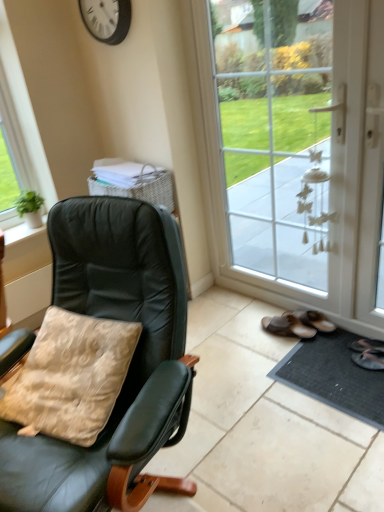
What is the approximate width of white plastic clock at upper center?

It is 6.50 centimeters.

What do you see at coordinates (288, 151) in the screenshot? Image resolution: width=384 pixels, height=512 pixels. I see `white glass door at center` at bounding box center [288, 151].

You are a GUI agent. You are given a task and a screenshot of the screen. Output one action in this format:
    pyautogui.click(x=<x>, y=<y>)
    Task: Click on the matte black chair at left
    
    Given the screenshot: What is the action you would take?
    pyautogui.click(x=131, y=361)

In the image, is matte black chair at left positioned in front of or behind white plastic clock at upper center?

In the image, matte black chair at left appears in front of white plastic clock at upper center.

From a real-world perspective, which is physically above, matte black chair at left or white plastic clock at upper center?

In real-world perspective, white plastic clock at upper center is above.

Is matte black chair at left touching white plastic clock at upper center?

No.

From the image's perspective, does matte black chair at left appear lower than white plastic clock at upper center?

Correct, matte black chair at left appears lower than white plastic clock at upper center in the image.

From a real-world perspective, which object stands above the other?

matte black chair at left, from a real-world perspective.

Which of these two, black rubber doormat at lower right or matte black chair at left, is wider?

Wider between the two is matte black chair at left.

Looking at this image, considering the sizes of black rubber doormat at lower right and matte black chair at left in the image, is black rubber doormat at lower right taller or shorter than matte black chair at left?

Considering their sizes, black rubber doormat at lower right has less height than matte black chair at left.

Is there a large distance between black rubber doormat at lower right and matte black chair at left?

Actually, black rubber doormat at lower right and matte black chair at left are a little close together.

Is beige velvety pillow at left next to matte black chair at left?

No, beige velvety pillow at left is not in contact with matte black chair at left.

What's the angular difference between beige velvety pillow at left and matte black chair at left's facing directions?

There is a 1.48-degree angle between the facing directions of beige velvety pillow at left and matte black chair at left.

At what (x,y) coordinates should I click in order to perform the action: click on chair that is on the right side of beige velvety pillow at left. Please return your answer as a coordinate pair (x, y). This screenshot has height=512, width=384. Looking at the image, I should click on click(131, 361).

Does beige velvety pillow at left appear on the right side of matte black chair at left?

No, beige velvety pillow at left is not to the right of matte black chair at left.

Is black rubber doormat at lower right taller than beige velvety pillow at left?

No, black rubber doormat at lower right is not taller than beige velvety pillow at left.

Considering the relative positions of black rubber doormat at lower right and beige velvety pillow at left in the image provided, is black rubber doormat at lower right to the right of beige velvety pillow at left from the viewer's perspective?

Yes, black rubber doormat at lower right is to the right of beige velvety pillow at left.

Considering the positions of point (368, 420) and point (118, 395), is point (368, 420) closer or farther from the camera than point (118, 395)?

Clearly, point (368, 420) is more distant from the camera than point (118, 395).

From a real-world perspective, which object rests below the other?

black rubber doormat at lower right, from a real-world perspective.

Locate an element on the screen. doormat lying in front of the white plastic clock at upper center is located at coordinates (334, 376).

Which object is thinner, white plastic clock at upper center or black rubber doormat at lower right?

white plastic clock at upper center is thinner.

From the image's perspective, which is below, white plastic clock at upper center or black rubber doormat at lower right?

From the image's view, black rubber doormat at lower right is below.

Is white plastic clock at upper center inside the boundaries of black rubber doormat at lower right, or outside?

white plastic clock at upper center cannot be found inside black rubber doormat at lower right.

From the picture: Who is taller, beige velvety pillow at left or black rubber doormat at lower right?

beige velvety pillow at left is taller.

Considering the positions of objects beige velvety pillow at left and black rubber doormat at lower right in the image provided, who is more to the left, beige velvety pillow at left or black rubber doormat at lower right?

beige velvety pillow at left.

From a real-world perspective, which is physically below, beige velvety pillow at left or black rubber doormat at lower right?

black rubber doormat at lower right is physically lower.

From the image's perspective, is beige velvety pillow at left positioned above or below black rubber doormat at lower right?

Clearly, from the image's perspective, beige velvety pillow at left is above black rubber doormat at lower right.

Is white plastic clock at upper center completely or partially outside of matte black chair at left?

Yes.

From the image's perspective, is white plastic clock at upper center located above or below matte black chair at left?

Based on their image positions, white plastic clock at upper center is located above matte black chair at left.

Between white plastic clock at upper center and matte black chair at left, which one has less height?

white plastic clock at upper center is shorter.

From a real-world perspective, who is located lower, white plastic clock at upper center or matte black chair at left?

From a 3D spatial view, matte black chair at left is below.

The width and height of the screenshot is (384, 512). I want to click on clock on the left side of matte black chair at left, so click(106, 19).

At what (x,y) coordinates should I click in order to perform the action: click on doormat below the matte black chair at left (from the image's perspective). Please return your answer as a coordinate pair (x, y). Looking at the image, I should click on (334, 376).

Estimate the real-world distances between objects in this image. Which object is closer to black rubber doormat at lower right, beige velvety pillow at left or white glass door at center?

white glass door at center is closer to black rubber doormat at lower right.

Looking at the image, which one is located further to black rubber doormat at lower right, white plastic clock at upper center or beige velvety pillow at left?

white plastic clock at upper center lies further to black rubber doormat at lower right than the other object.

Looking at this image, considering their positions, is matte black chair at left positioned further to white plastic clock at upper center than beige velvety pillow at left?

beige velvety pillow at left lies further to white plastic clock at upper center than the other object.

Considering their positions, is beige velvety pillow at left positioned closer to white glass door at center than matte black chair at left?

matte black chair at left.

When comparing their distances from black rubber doormat at lower right, does beige velvety pillow at left or white plastic clock at upper center seem further?

white plastic clock at upper center.

Which object lies further to the anchor point matte black chair at left, black rubber doormat at lower right or white plastic clock at upper center?

Among the two, white plastic clock at upper center is located further to matte black chair at left.

Based on their spatial positions, is white glass door at center or matte black chair at left further from beige velvety pillow at left?

The object further to beige velvety pillow at left is white glass door at center.

Which object lies nearer to the anchor point matte black chair at left, white glass door at center or beige velvety pillow at left?

beige velvety pillow at left is closer to matte black chair at left.

Where is `door that lies between white plastic clock at upper center and black rubber doormat at lower right from top to bottom`? Image resolution: width=384 pixels, height=512 pixels. door that lies between white plastic clock at upper center and black rubber doormat at lower right from top to bottom is located at coordinates (288, 151).

The width and height of the screenshot is (384, 512). Identify the location of door between white plastic clock at upper center and beige velvety pillow at left from top to bottom. (288, 151).

The height and width of the screenshot is (512, 384). I want to click on door located between matte black chair at left and black rubber doormat at lower right in the left-right direction, so click(288, 151).

The height and width of the screenshot is (512, 384). In order to click on chair between white glass door at center and beige velvety pillow at left from top to bottom in this screenshot , I will do `click(131, 361)`.